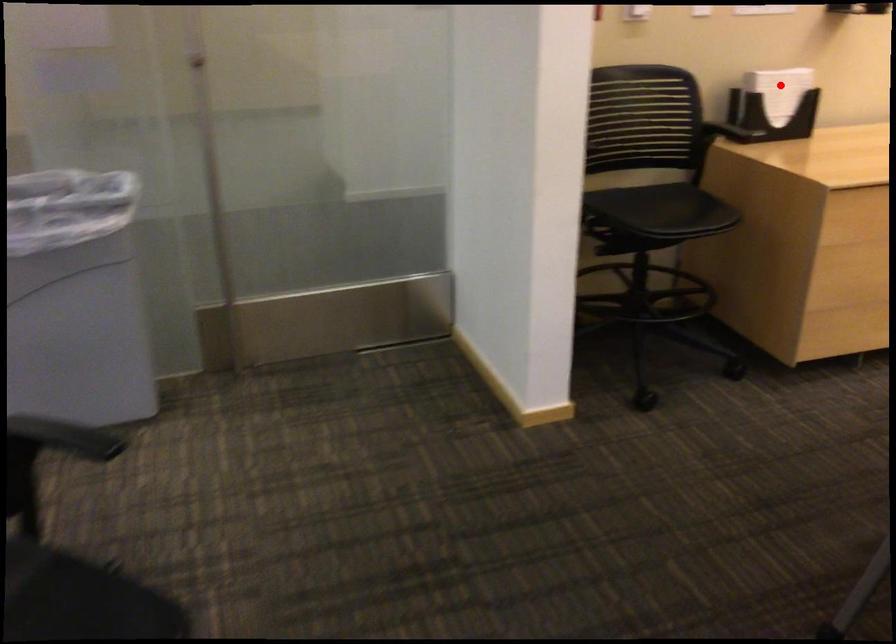
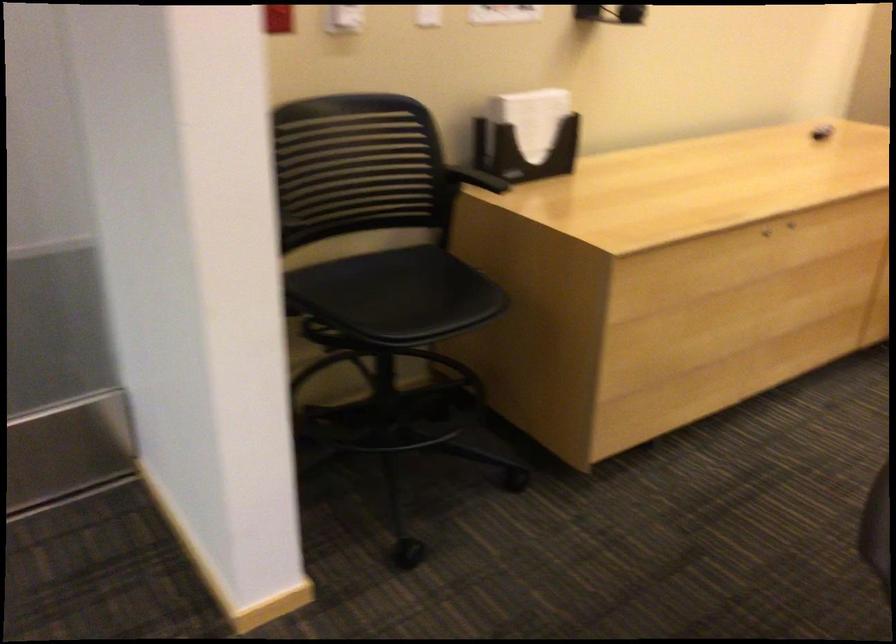
Question: I am providing you with two images of the same scene from different viewpoints. Given a red point in image1, look at the same physical point in image2. Is it:

Choices:
 (A) Closer to the viewpoint
 (B) Farther from the viewpoint

Answer: (A)